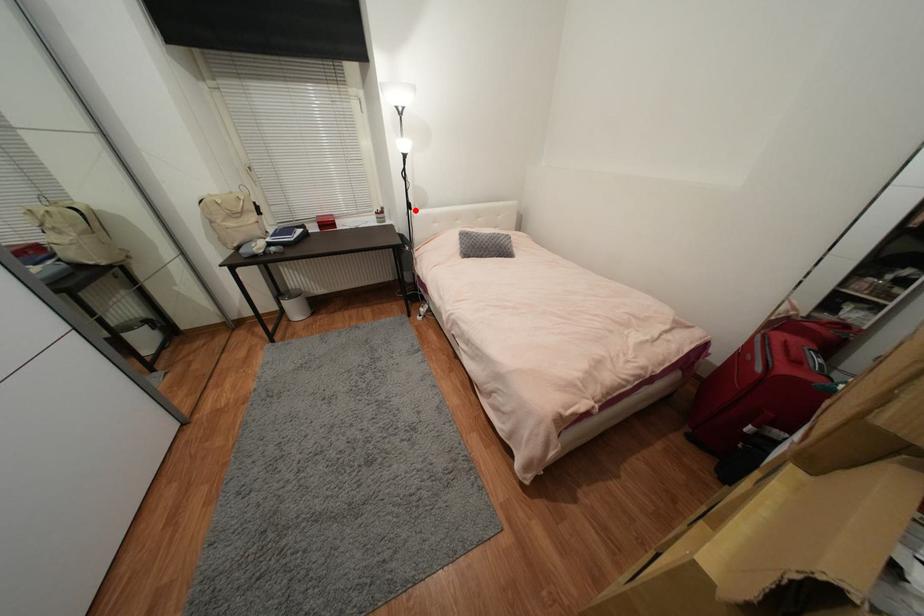
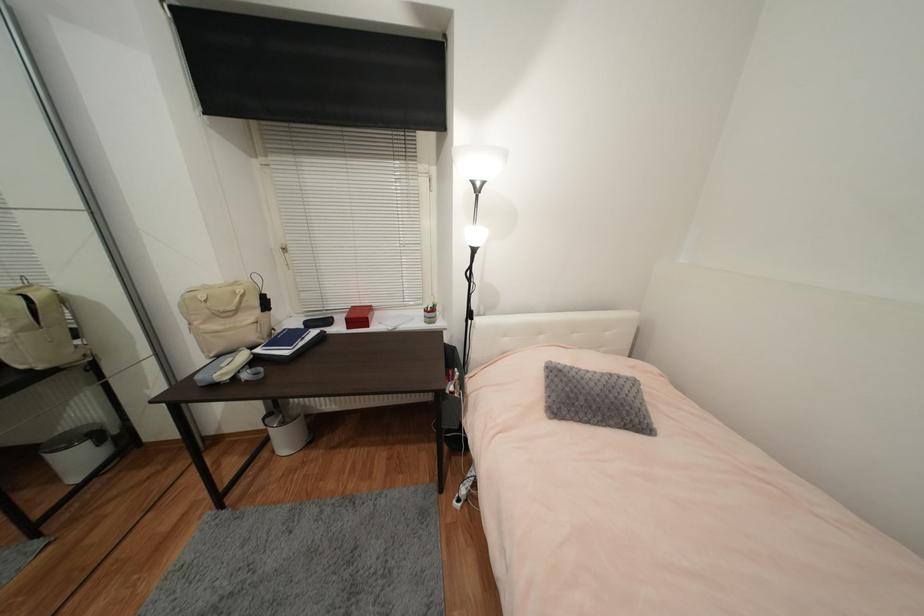
Where in the second image is the point corresponding to the highlighted location from the first image?

(477, 320)